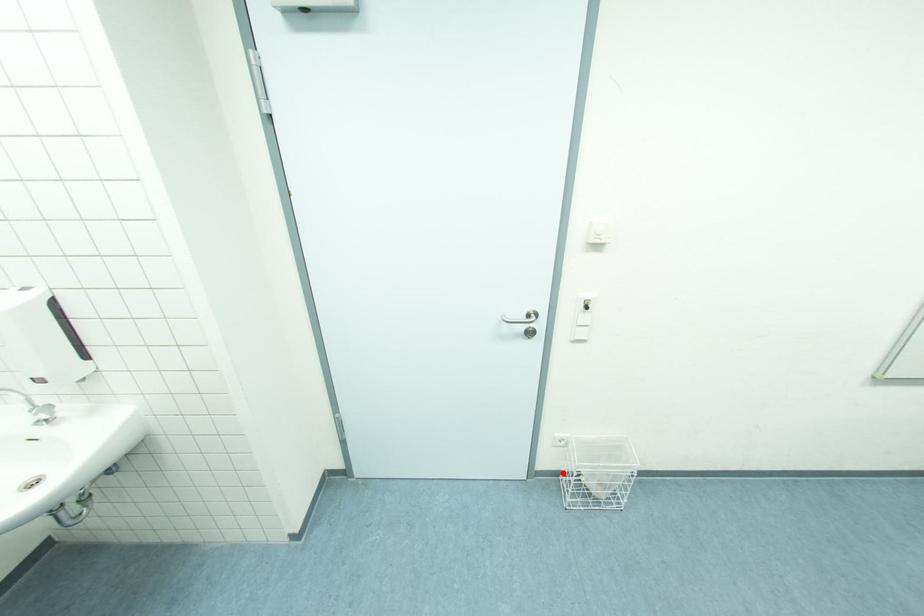
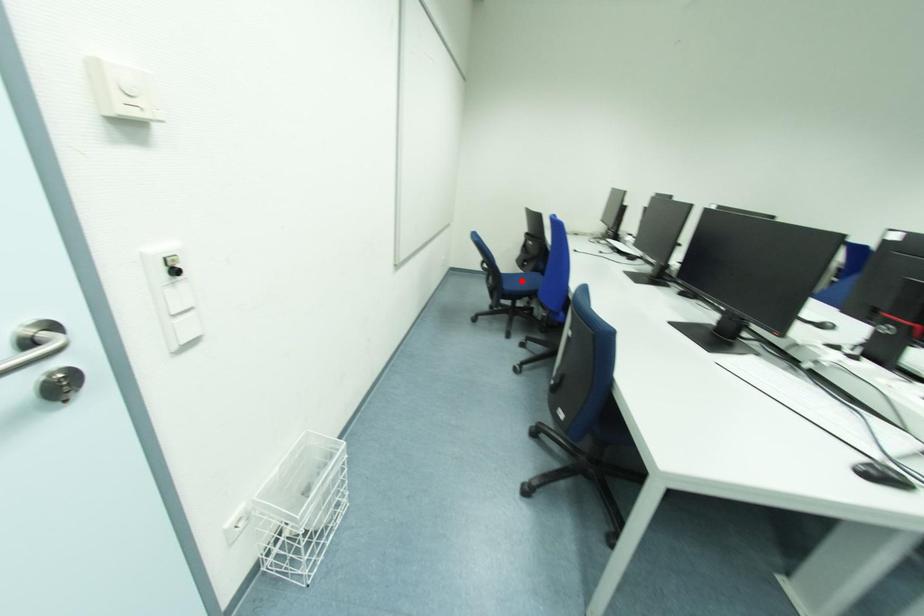
I am providing you with two images of the same scene from different viewpoints. A red point is marked on the first image and another point is marked on the second image. Does the point marked in image1 correspond to the same location as the one in image2?

No